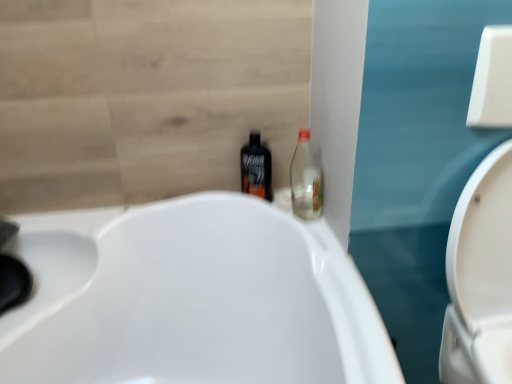
What is the approximate height of white glossy toilet at right?

The height of white glossy toilet at right is 29.67 inches.

Locate an element on the screen. This screenshot has width=512, height=384. white glossy toilet at right is located at coordinates (480, 277).

From the picture: Measure the distance from white glossy toilet at right to black plastic bottle at center, the 1th bottle positioned from the left.

The distance of white glossy toilet at right from black plastic bottle at center, the 1th bottle positioned from the left, is 22.22 inches.

Is white glossy toilet at right far from black plastic bottle at center, the 1th bottle positioned from the left?

No, white glossy toilet at right is not far from black plastic bottle at center, the 1th bottle positioned from the left.

This screenshot has width=512, height=384. I want to click on toilet on the right of black plastic bottle at center, the second bottle from the right, so click(x=480, y=277).

Is white glossy toilet at right surrounded by black plastic bottle at center, the 1th bottle positioned from the left?

Definitely not — white glossy toilet at right is not inside black plastic bottle at center, the 1th bottle positioned from the left.

Considering the relative sizes of black plastic bottle at center, the second bottle from the right, and white glossy toilet at right in the image provided, is black plastic bottle at center, the second bottle from the right, smaller than white glossy toilet at right?

Yes.

From the image's perspective, which is above, black plastic bottle at center, the 1th bottle positioned from the left, or white glossy toilet at right?

black plastic bottle at center, the 1th bottle positioned from the left, appears higher in the image.

Find the location of a particular element. This screenshot has width=512, height=384. toilet located in front of the black plastic bottle at center, the 1th bottle positioned from the left is located at coordinates (480, 277).

Is there a large distance between white glossy toilet at right and transparent glass bottle at center-right, arranged as the 2th bottle when viewed from the left?

white glossy toilet at right is actually quite close to transparent glass bottle at center-right, arranged as the 2th bottle when viewed from the left.

This screenshot has height=384, width=512. What are the coordinates of `toilet below the transparent glass bottle at center-right, arranged as the 2th bottle when viewed from the left (from the image's perspective)` in the screenshot? It's located at (480, 277).

How much distance is there between white glossy toilet at right and transparent glass bottle at center-right, arranged as the 2th bottle when viewed from the left?

They are 16.21 inches apart.

Consider the image. From the image's perspective, which one is positioned higher, white glossy toilet at right or transparent glass bottle at center-right, arranged as the 2th bottle when viewed from the left?

transparent glass bottle at center-right, arranged as the 2th bottle when viewed from the left, appears higher in the image.

Measure the distance between transparent glass bottle at center-right, arranged as the 2th bottle when viewed from the left, and black plastic bottle at center, the second bottle from the right.

A distance of 4.70 inches exists between transparent glass bottle at center-right, arranged as the 2th bottle when viewed from the left, and black plastic bottle at center, the second bottle from the right.

From the image's perspective, is transparent glass bottle at center-right, arranged as the 2th bottle when viewed from the left, on top of black plastic bottle at center, the 1th bottle positioned from the left?

No, from the image's perspective, transparent glass bottle at center-right, arranged as the 2th bottle when viewed from the left, is not above black plastic bottle at center, the 1th bottle positioned from the left.

Is transparent glass bottle at center-right, arranged as the 2th bottle when viewed from the left, positioned in front of black plastic bottle at center, the second bottle from the right?

That is True.

Find the location of a particular element. Image resolution: width=512 pixels, height=384 pixels. bottle below the black plastic bottle at center, the 1th bottle positioned from the left (from the image's perspective) is located at coordinates (305, 180).

In the scene shown: Can you confirm if transparent glass bottle at center-right, the 1th bottle from the right, is thinner than white glossy toilet at right?

Yes, transparent glass bottle at center-right, the 1th bottle from the right, is thinner than white glossy toilet at right.

Is point (300, 180) positioned after point (478, 185)?

Yes, it is behind point (478, 185).

Which of these two, transparent glass bottle at center-right, the 1th bottle from the right, or white glossy toilet at right, is bigger?

white glossy toilet at right is bigger.

From a real-world perspective, between transparent glass bottle at center-right, arranged as the 2th bottle when viewed from the left, and white glossy toilet at right, who is vertically lower?

From a 3D spatial view, white glossy toilet at right is below.

Is black plastic bottle at center, the second bottle from the right, completely or partially outside of transparent glass bottle at center-right, the 1th bottle from the right?

Yes, black plastic bottle at center, the second bottle from the right, is outside of transparent glass bottle at center-right, the 1th bottle from the right.

Can you confirm if black plastic bottle at center, the second bottle from the right, is wider than transparent glass bottle at center-right, the 1th bottle from the right?

Correct, the width of black plastic bottle at center, the second bottle from the right, exceeds that of transparent glass bottle at center-right, the 1th bottle from the right.

This screenshot has height=384, width=512. Find the location of `bottle that is the 1st object above the white glossy toilet at right (from a real-world perspective)`. bottle that is the 1st object above the white glossy toilet at right (from a real-world perspective) is located at coordinates (256, 168).

This screenshot has height=384, width=512. In the image, there is a black plastic bottle at center, the 1th bottle positioned from the left. Find the location of `toilet below it (from a real-world perspective)`. toilet below it (from a real-world perspective) is located at coordinates (480, 277).

Based on the photo, considering their positions, is transparent glass bottle at center-right, the 1th bottle from the right, positioned further to white glossy toilet at right than black plastic bottle at center, the second bottle from the right?

black plastic bottle at center, the second bottle from the right.

Based on their spatial positions, is black plastic bottle at center, the second bottle from the right, or white glossy toilet at right further from transparent glass bottle at center-right, the 1th bottle from the right?

white glossy toilet at right is further to transparent glass bottle at center-right, the 1th bottle from the right.

When comparing their distances from white glossy toilet at right, does black plastic bottle at center, the second bottle from the right, or transparent glass bottle at center-right, arranged as the 2th bottle when viewed from the left, seem closer?

Among the two, transparent glass bottle at center-right, arranged as the 2th bottle when viewed from the left, is located nearer to white glossy toilet at right.

Looking at the image, which one is located further to black plastic bottle at center, the 1th bottle positioned from the left, white glossy toilet at right or transparent glass bottle at center-right, the 1th bottle from the right?

The object further to black plastic bottle at center, the 1th bottle positioned from the left, is white glossy toilet at right.

Looking at the image, which one is located further to black plastic bottle at center, the 1th bottle positioned from the left, transparent glass bottle at center-right, arranged as the 2th bottle when viewed from the left, or white glossy toilet at right?

white glossy toilet at right lies further to black plastic bottle at center, the 1th bottle positioned from the left, than the other object.

Looking at the image, which one is located closer to transparent glass bottle at center-right, arranged as the 2th bottle when viewed from the left, white glossy toilet at right or black plastic bottle at center, the second bottle from the right?

Based on the image, black plastic bottle at center, the second bottle from the right, appears to be nearer to transparent glass bottle at center-right, arranged as the 2th bottle when viewed from the left.

What are the coordinates of `bottle located between black plastic bottle at center, the 1th bottle positioned from the left, and white glossy toilet at right in the left-right direction` in the screenshot? It's located at (305, 180).